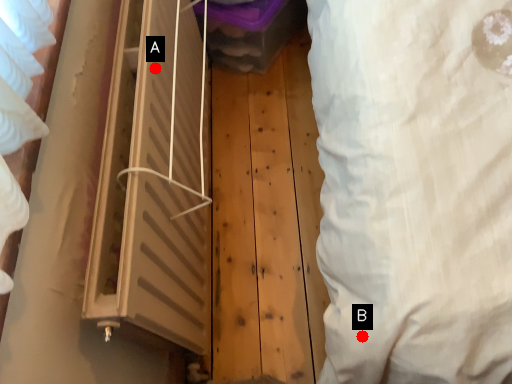
Question: Two points are circled on the image, labeled by A and B beside each circle. Among these points, which one is farthest from the camera?

Choices:
 (A) A is further
 (B) B is further

Answer: (A)